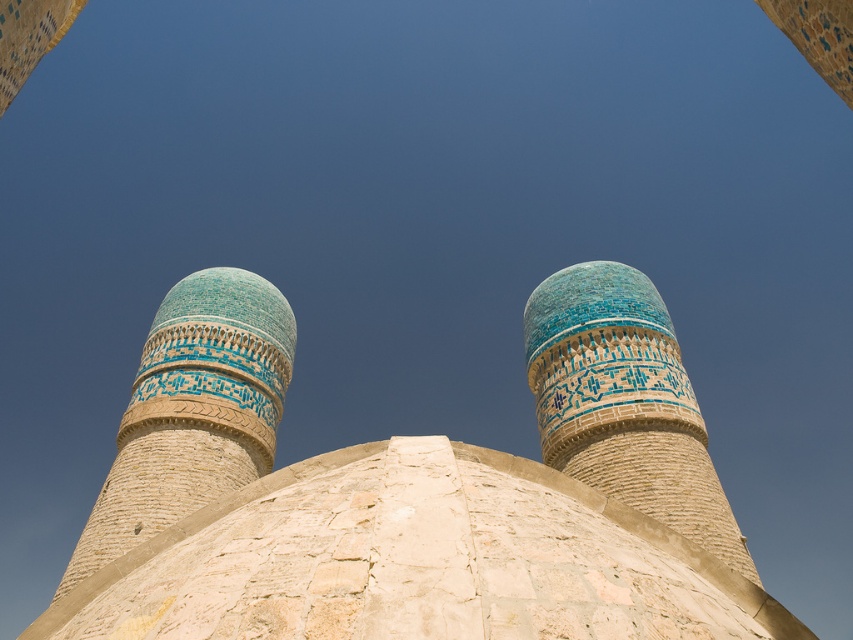
You are an architect analyzing the two central structures in the image. Which of the two, the turquoise mosaic dome at center or the blue glazed brick minaret at center, has a greater height?

The blue glazed brick minaret at center is taller than the turquoise mosaic dome at center.

You are standing in front of the two cylindrical towers. You notice two points marked on the towers. One is at coordinate point (688, 502) and the other at point (183, 365). Which of these points is physically closer to your current position?

Point (688, 502) is closer to the camera than point (183, 365), so the point at coordinate (688, 502) is physically closer to your current position.

You are standing at the base of the turquoise mosaic dome at center. You want to walk straight ahead to a point 50 meters away from the dome. Will you be able to reach that point before the dome is no longer visible in your line of sight?

The distance between the turquoise mosaic dome at center and the camera is 51.83 meters. Since you want to walk 50 meters away from the dome, you will be closer to the dome than the current camera position. Therefore, the dome will still be visible in your line of sight when you reach the 50 meters point.